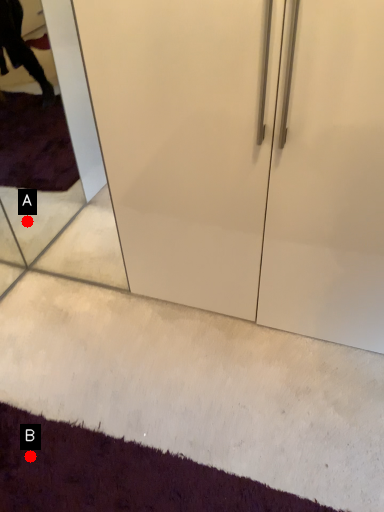
Question: Two points are circled on the image, labeled by A and B beside each circle. Which point appears closest to the camera in this image?

Choices:
 (A) A is closer
 (B) B is closer

Answer: (B)